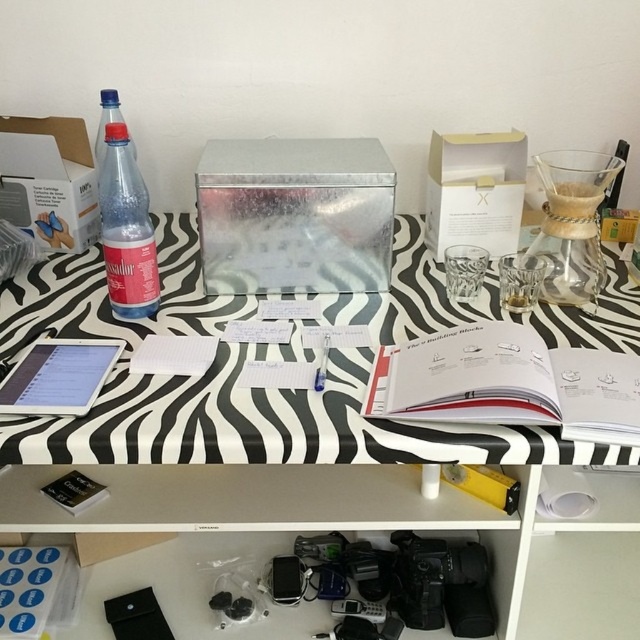
What do you see at coordinates (273, 388) in the screenshot? I see `zebra-patterned table at center` at bounding box center [273, 388].

Identify the location of zebra-patterned table at center. (273, 388).